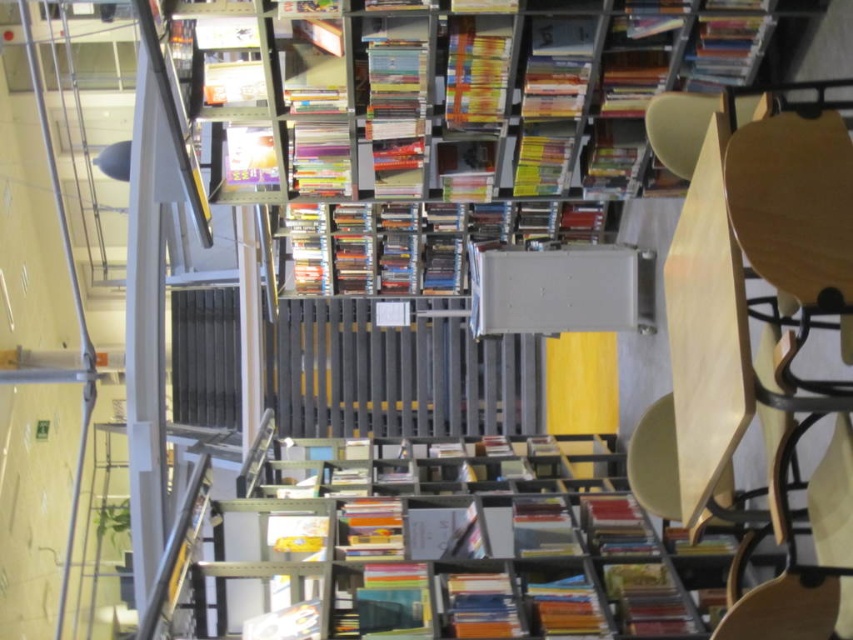
Question: Which of the following is the closest to the observer?

Choices:
 (A) (746, 173)
 (B) (488, 595)

Answer: (A)

Question: Is wooden chair at right positioned in front of orange matte book at center?

Choices:
 (A) no
 (B) yes

Answer: (B)

Question: Which of the following is the closest to the observer?

Choices:
 (A) white paper at upper center
 (B) wooden chair at right

Answer: (B)

Question: Is wooden chair at right thinner than white paper at upper center?

Choices:
 (A) no
 (B) yes

Answer: (A)

Question: Is wooden chair at right above orange matte book at center?

Choices:
 (A) yes
 (B) no

Answer: (A)

Question: Among these points, which one is farthest from the camera?

Choices:
 (A) (262, 68)
 (B) (787, 186)
 (C) (505, 580)

Answer: (A)